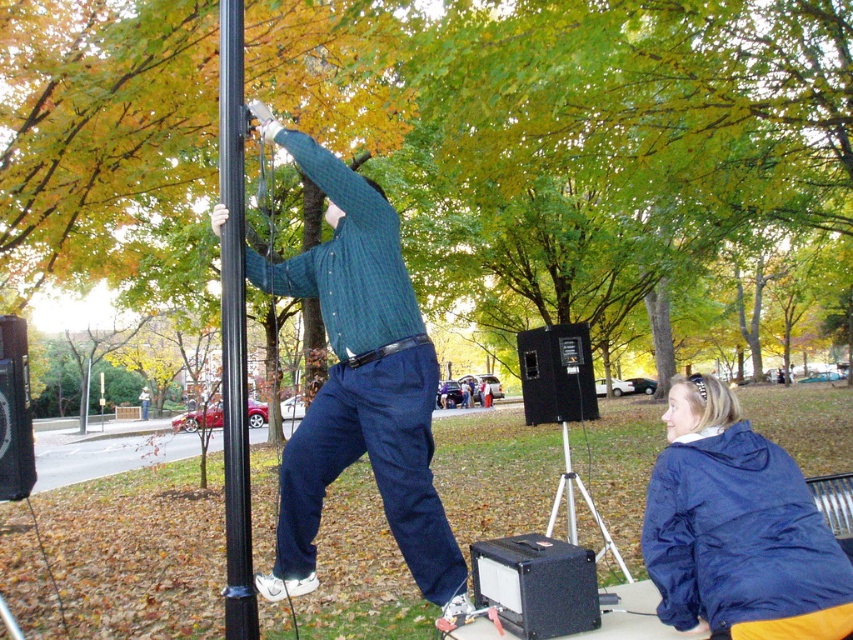
You are a photographer standing in the park and want to take a photo of the green leafy tree at upper center and the matte blue jacket at lower right. Which object should you focus on first if you want to capture both in the same frame without moving the camera?

The green leafy tree at upper center is located above the matte blue jacket at lower right, so you should focus on the matte blue jacket at lower right first to ensure both are in focus, as it is closer to the camera.

You are standing in the park and want to take a photo of the green leafy tree at upper center without any obstructions. The camera you have can focus on objects up to 5 meters away. Will the tree be in focus?

The green leafy tree at upper center is 5.45 meters from viewer, which is beyond the camera focus range of 5 meters. The tree will not be in focus.